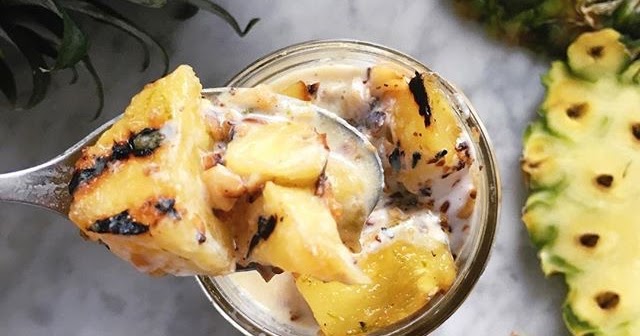
Locate an element on the screen. This screenshot has height=336, width=640. table is located at coordinates (451, 36).